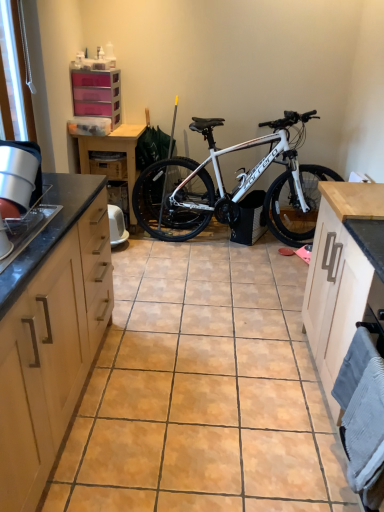
Find the location of `free space in front of white metallic bicycle at center`. free space in front of white metallic bicycle at center is located at coordinates (243, 283).